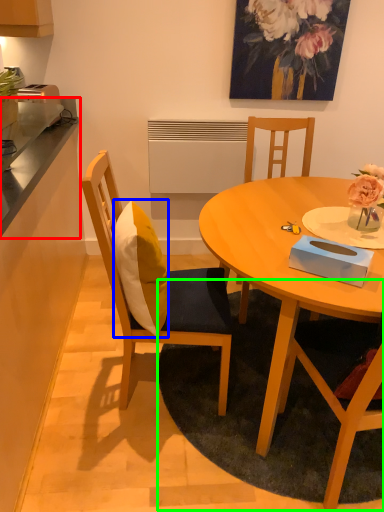
Question: Estimate the real-world distances between objects in this image. Which object is closer to counter top (highlighted by a red box), pillow (highlighted by a blue box) or mat (highlighted by a green box)?

Choices:
 (A) pillow
 (B) mat

Answer: (A)